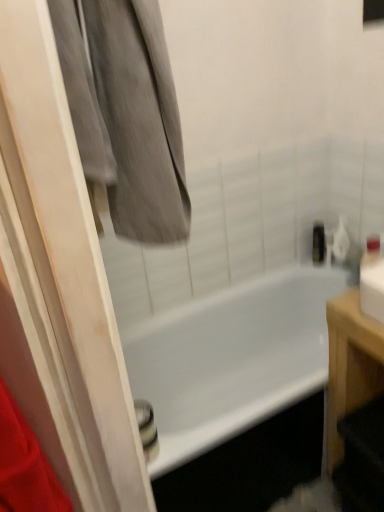
Question: Is point tap(162, 403) closer or farther from the camera than point tap(314, 224)?

Choices:
 (A) closer
 (B) farther

Answer: (A)

Question: From the image's perspective, is white glossy bathtub at center positioned above or below metallic silver toiletry at upper right?

Choices:
 (A) below
 (B) above

Answer: (A)

Question: Considering the real-world distances, which object is closest to the white glossy bathtub at center?

Choices:
 (A) metallic silver toiletry at upper right
 (B) gray fabric at upper left
 (C) light brown wooden table at right

Answer: (A)

Question: Estimate the real-world distances between objects in this image. Which object is closer to the light brown wooden table at right?

Choices:
 (A) gray fabric at upper left
 (B) metallic silver toiletry at upper right
 (C) white glossy bathtub at center

Answer: (C)